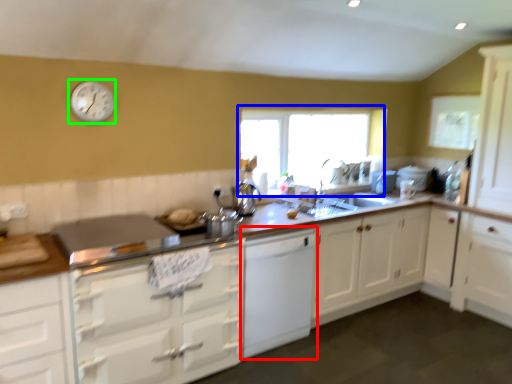
Question: Considering the real-world distances, which object is farthest from cabinetry (highlighted by a red box)? window (highlighted by a blue box) or clock (highlighted by a green box)?

Choices:
 (A) window
 (B) clock

Answer: (B)